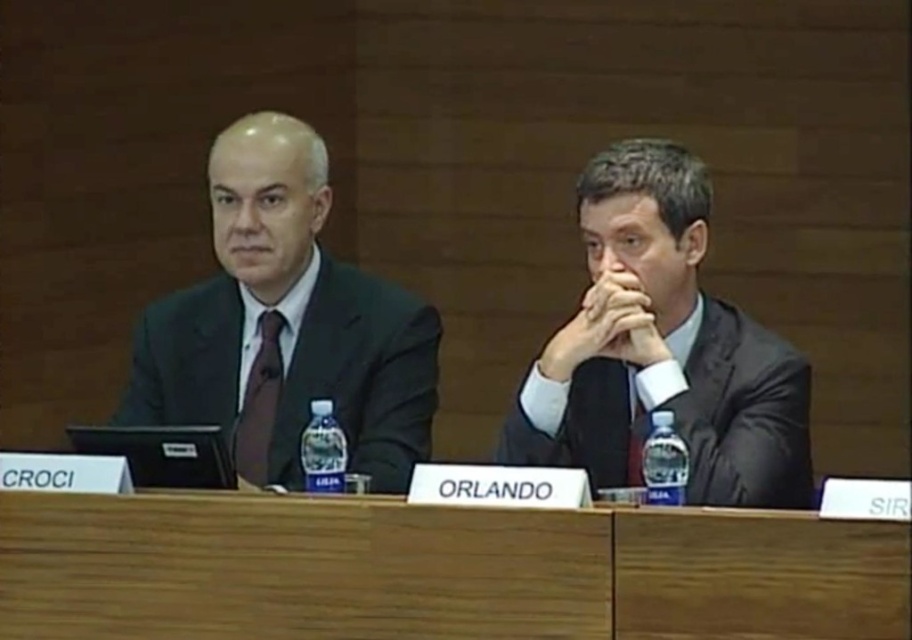
What are the coordinates of the dark gray suit at center in the image?

The coordinates of the dark gray suit at center are at point [662,348].

From the picture: You are a photographer setting up for a professional photo shoot at a conference table. You need to ensure that the dark gray suit at center and the matte brown tie at center are both visible in the frame. Based on their positions, which object should you focus on first to ensure both are in focus?

The dark gray suit at center is in front of the matte brown tie at center, so you should focus on the dark gray suit at center first to ensure both are in focus.